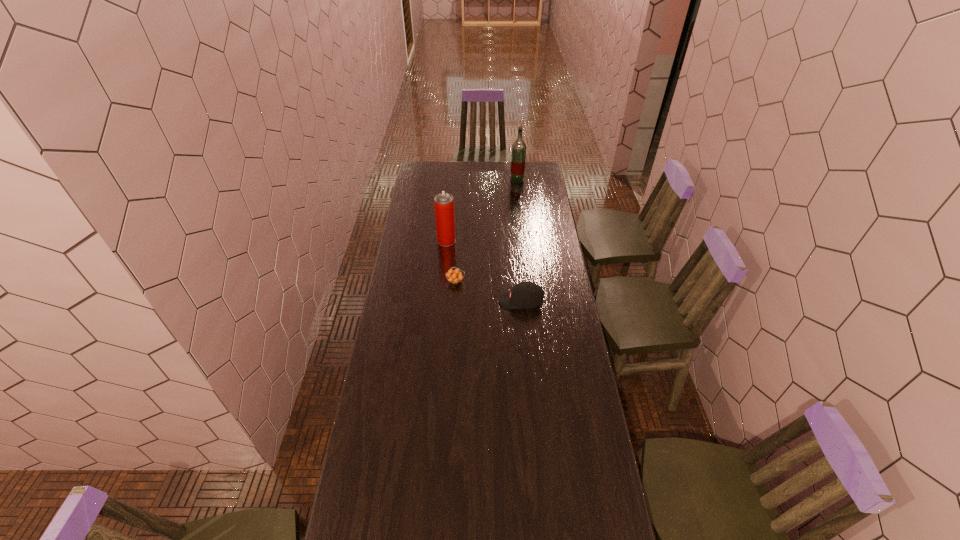
I want to click on the second closest object relative to the third nearest object, so click(x=525, y=295).

Locate an element on the screen. The image size is (960, 540). the closest object to the third nearest object is located at coordinates (455, 276).

Locate an element on the screen. This screenshot has width=960, height=540. vacant space that satisfies the following two spatial constraints: 1. on the front side of the farthest object; 2. with a logo on the front of the nearest object is located at coordinates (531, 301).